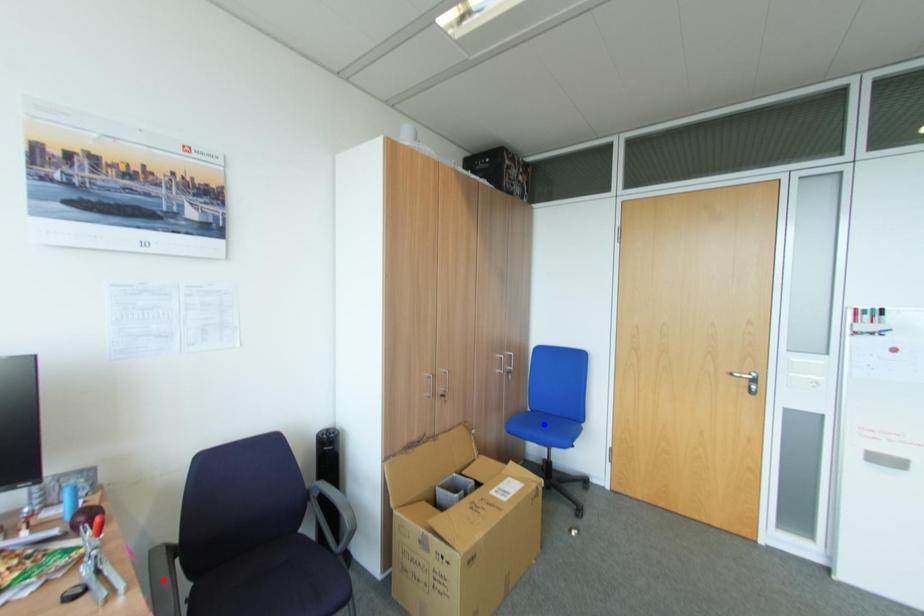
Question: In the image, two points are highlighted. Which point is nearer to the camera? Reply with the corresponding letter.

Choices:
 (A) blue point
 (B) red point

Answer: (B)